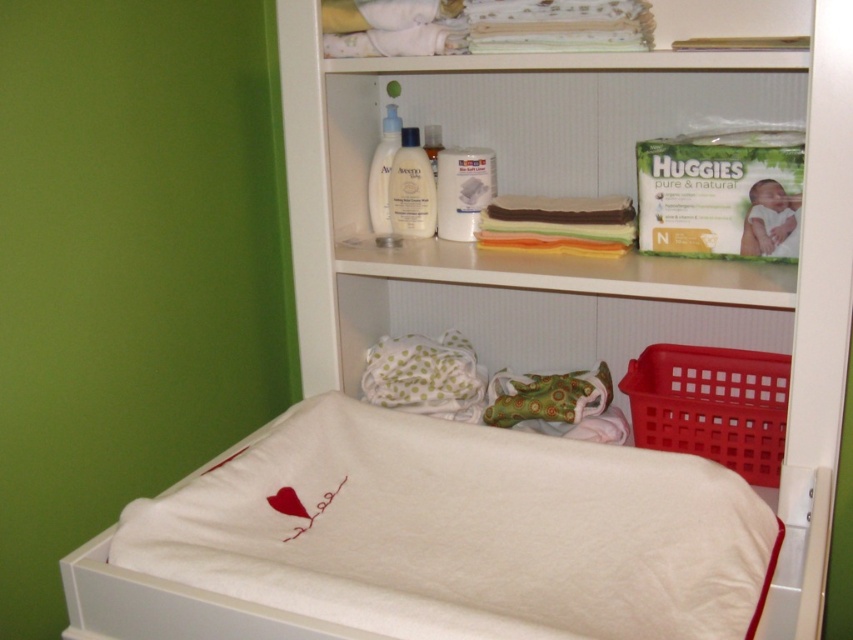
You need to place a new toy that is 2 feet wide into the baby changing station area. The white soft fabric infant bed at lower center and the white plastic shelf at upper center are already present. Which object can accommodate the toy in terms of width?

The white soft fabric infant bed at lower center can accommodate the toy since its width is greater than the white plastic shelf at upper center.